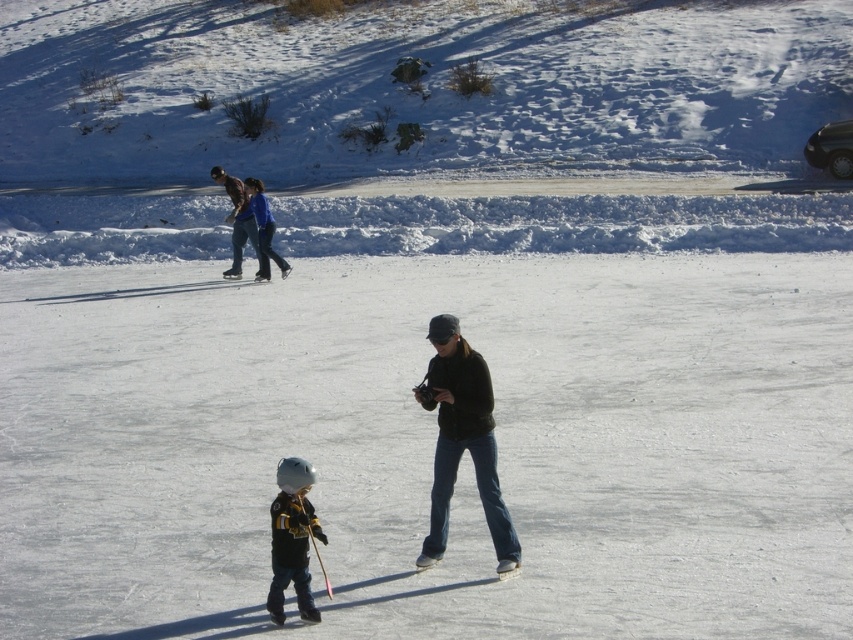
You are a photographer trying to capture a clear photo of the matte black helmet at center and the white plastic ski at center. Since both are at the center, you need to adjust your focus. Which object should you focus on first if you want to ensure the taller object is in sharp focus?

The matte black helmet at center is taller than the white plastic ski at center, so you should focus on the matte black helmet at center first to ensure it is in sharp focus.

In the scene shown: You are an ice rink attendant and need to ensure safety by checking if the objects are within the allowed height limits. The black matte jacket at center and the white plastic ski at center are both present. According to the rink rules, all objects must be under 1 meter in height. Can both items comply with the height restriction?

The black matte jacket at center is much taller than the white plastic ski at center. Since the jacket is taller, it may exceed the 1 meter height limit, while the ski might be under. However, without exact measurements, we can only confirm that the ski is shorter than the jacket. Both items might not comply, but the jacket is the primary concern.

You are a photographer trying to capture a photo of the black matte jacket at center and the matte black helmet at center. From which side should you position yourself to ensure both objects are visible in the frame?

You should position yourself to the left of the black matte jacket at center and matte black helmet at center so that both objects are visible in the frame, as the black matte jacket at center is to the right of the matte black helmet at center.